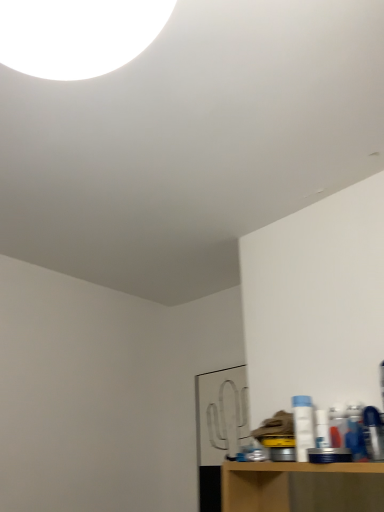
This screenshot has width=384, height=512. What do you see at coordinates (303, 426) in the screenshot? I see `white plastic bottle at right` at bounding box center [303, 426].

This screenshot has width=384, height=512. I want to click on white plastic bottle at right, so click(x=303, y=426).

What do you see at coordinates (77, 35) in the screenshot?
I see `white glossy light at upper center` at bounding box center [77, 35].

This screenshot has width=384, height=512. I want to click on white glossy light at upper center, so click(x=77, y=35).

The height and width of the screenshot is (512, 384). What are the coordinates of `white plastic bottle at right` in the screenshot? It's located at (303, 426).

Considering the relative positions of white glossy light at upper center and white plastic bottle at right in the image provided, is white glossy light at upper center to the left or to the right of white plastic bottle at right?

In the image, white glossy light at upper center appears on the left side of white plastic bottle at right.

Relative to white plastic bottle at right, is white glossy light at upper center in front or behind?

Clearly, white glossy light at upper center is in front of white plastic bottle at right.

Does point (96, 56) lie behind point (312, 433)?

No, (96, 56) is closer to viewer.

From the image's perspective, is white glossy light at upper center beneath white plastic bottle at right?

Incorrect, from the image's perspective, white glossy light at upper center is higher than white plastic bottle at right.

From a real-world perspective, is white glossy light at upper center positioned over white plastic bottle at right based on gravity?

Correct, in the physical world, white glossy light at upper center is higher than white plastic bottle at right.

Which of these two, white glossy light at upper center or white plastic bottle at right, is wider?

white glossy light at upper center is wider.

Considering the sizes of objects white glossy light at upper center and white plastic bottle at right in the image provided, who is taller, white glossy light at upper center or white plastic bottle at right?

white glossy light at upper center is taller.

Does white glossy light at upper center have a smaller size compared to white plastic bottle at right?

Actually, white glossy light at upper center might be larger than white plastic bottle at right.

Is white glossy light at upper center spatially inside white plastic bottle at right, or outside of it?

white glossy light at upper center is outside white plastic bottle at right.

Is white glossy light at upper center placed right next to white plastic bottle at right?

There is a gap between white glossy light at upper center and white plastic bottle at right.

Is white glossy light at upper center facing away from white plastic bottle at right?

No, white glossy light at upper center's orientation is not away from white plastic bottle at right.

Identify the location of light located above the white plastic bottle at right (from a real-world perspective). (77, 35).

Which object is positioned more to the left, white plastic bottle at right or white glossy light at upper center?

Positioned to the left is white glossy light at upper center.

Relative to white glossy light at upper center, is white plastic bottle at right in front or behind?

Visually, white plastic bottle at right is located behind white glossy light at upper center.

Which point is more distant from viewer, (301, 415) or (9, 39)?

The point (301, 415) is farther.

From the image's perspective, which is below, white plastic bottle at right or white glossy light at upper center?

white plastic bottle at right appears lower in the image.

From a real-world perspective, which object rests below the other?

In real-world perspective, white plastic bottle at right is lower.

Between white plastic bottle at right and white glossy light at upper center, which one has smaller width?

white plastic bottle at right.

Is white plastic bottle at right taller or shorter than white glossy light at upper center?

In the image, white plastic bottle at right appears to be shorter than white glossy light at upper center.

Consider the image. Based on their sizes in the image, would you say white plastic bottle at right is bigger or smaller than white glossy light at upper center?

Clearly, white plastic bottle at right is smaller in size than white glossy light at upper center.

Which is correct: white plastic bottle at right is inside white glossy light at upper center, or outside of it?

white plastic bottle at right is not inside white glossy light at upper center, it's outside.

Is white plastic bottle at right touching white glossy light at upper center?

They are not placed beside each other.

Is white plastic bottle at right positioned with its back to white glossy light at upper center?

No, white plastic bottle at right is not facing the opposite direction of white glossy light at upper center.

What's the angular difference between white plastic bottle at right and white glossy light at upper center's facing directions?

The angle between the facing direction of white plastic bottle at right and the facing direction of white glossy light at upper center is 179 degrees.

This screenshot has width=384, height=512. What are the coordinates of `bottle lying below the white glossy light at upper center (from the image's perspective)` in the screenshot? It's located at (303, 426).

The image size is (384, 512). I want to click on bottle behind the white glossy light at upper center, so click(303, 426).

Find the location of a particular element. This screenshot has height=512, width=384. bottle located underneath the white glossy light at upper center (from a real-world perspective) is located at coordinates (303, 426).